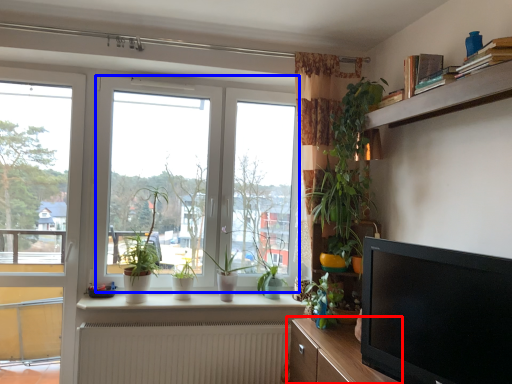
Question: Among these objects, which one is farthest to the camera, cabinetry (highlighted by a red box) or window (highlighted by a blue box)?

Choices:
 (A) cabinetry
 (B) window

Answer: (B)